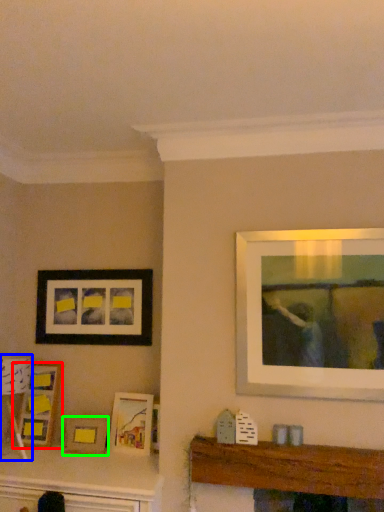
Question: Which is farther away from picture frame (highlighted by a red box)? lamp (highlighted by a blue box) or picture frame (highlighted by a green box)?

Choices:
 (A) lamp
 (B) picture frame

Answer: (B)